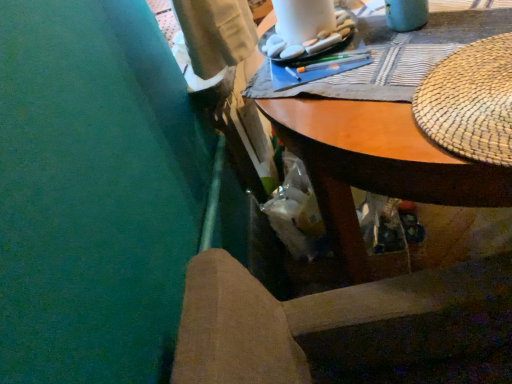
The height and width of the screenshot is (384, 512). I want to click on wooden chair at lower center, so click(x=333, y=321).

The height and width of the screenshot is (384, 512). What do you see at coordinates (470, 102) in the screenshot?
I see `woven straw placemat at upper right` at bounding box center [470, 102].

This screenshot has height=384, width=512. What are the coordinates of `wooden desk at upper center` in the screenshot? It's located at (374, 164).

What do you see at coordinates (308, 41) in the screenshot? This screenshot has width=512, height=384. I see `white matte rocks at upper center` at bounding box center [308, 41].

Measure the distance between white matte rocks at upper center and camera.

The depth of white matte rocks at upper center is 37.02 inches.

What are the coordinates of `wooden chair at lower center` in the screenshot? It's located at (333, 321).

Does white matte rocks at upper center have a greater height compared to wooden chair at lower center?

No, white matte rocks at upper center is not taller than wooden chair at lower center.

From the picture: Are white matte rocks at upper center and wooden chair at lower center located far from each other?

white matte rocks at upper center is near wooden chair at lower center, not far away.

From a real-world perspective, which object stands above the other?

In real-world perspective, white matte rocks at upper center is above.

Consider the image. Which of these two, wooden chair at lower center or wooden desk at upper center, stands shorter?

wooden chair at lower center is shorter.

From a real-world perspective, which object rests below the other?

From a 3D spatial view, wooden desk at upper center is below.

In the scene shown: Which object is further away from the camera, wooden chair at lower center or wooden desk at upper center?

wooden desk at upper center is further from the camera.

Can you tell me how much white matte rocks at upper center and woven straw placemat at upper right differ in facing direction?

white matte rocks at upper center and woven straw placemat at upper right are facing 88.7 degrees away from each other.

From the picture: Would you consider white matte rocks at upper center to be distant from woven straw placemat at upper right?

white matte rocks at upper center is actually quite close to woven straw placemat at upper right.

Is white matte rocks at upper center thinner than woven straw placemat at upper right?

Yes, white matte rocks at upper center is thinner than woven straw placemat at upper right.

Can you confirm if white matte rocks at upper center is positioned to the left of woven straw placemat at upper right?

Correct, you'll find white matte rocks at upper center to the left of woven straw placemat at upper right.

What are the coordinates of `hat that appears above the wooden desk at upper center (from a real-world perspective)` in the screenshot? It's located at (470, 102).

Considering the relative sizes of woven straw placemat at upper right and wooden desk at upper center in the image provided, is woven straw placemat at upper right shorter than wooden desk at upper center?

Yes.

Are woven straw placemat at upper right and wooden desk at upper center making contact?

No.

From a real-world perspective, is woven straw placemat at upper right on top of wooden desk at upper center?

Yes.

How distant is wooden desk at upper center from white matte rocks at upper center?

9.53 inches.

Is the depth of wooden desk at upper center greater than that of white matte rocks at upper center?

No, wooden desk at upper center is closer to the viewer.

From a real-world perspective, between wooden desk at upper center and white matte rocks at upper center, who is vertically higher?

From a 3D spatial view, white matte rocks at upper center is above.

Considering the relative sizes of wooden desk at upper center and white matte rocks at upper center in the image provided, is wooden desk at upper center bigger than white matte rocks at upper center?

Correct, wooden desk at upper center is larger in size than white matte rocks at upper center.

Which of these two, wooden chair at lower center or white matte rocks at upper center, is wider?

wooden chair at lower center.

Which of these two, wooden chair at lower center or white matte rocks at upper center, stands taller?

With more height is wooden chair at lower center.

Does wooden chair at lower center appear on the left side of white matte rocks at upper center?

In fact, wooden chair at lower center is to the right of white matte rocks at upper center.

In the scene shown: Is wooden chair at lower center further to the viewer compared to white matte rocks at upper center?

No, it is not.

Does point (486, 170) appear closer or farther from the camera than point (229, 299)?

Point (486, 170) appears to be farther away from the viewer than point (229, 299).

Between wooden desk at upper center and wooden chair at lower center, which one has less height?

With less height is wooden chair at lower center.

Based on their sizes in the image, would you say wooden desk at upper center is bigger or smaller than wooden chair at lower center?

wooden desk at upper center is bigger than wooden chair at lower center.

Identify the location of chair in front of the wooden desk at upper center. This screenshot has width=512, height=384. (333, 321).

The width and height of the screenshot is (512, 384). In order to click on food above the wooden chair at lower center (from a real-world perspective) in this screenshot , I will do `click(308, 41)`.

Image resolution: width=512 pixels, height=384 pixels. What are the coordinates of `chair in front of the wooden desk at upper center` in the screenshot? It's located at tap(333, 321).

Which object lies nearer to the anchor point white matte rocks at upper center, woven straw placemat at upper right or wooden chair at lower center?

Based on the image, woven straw placemat at upper right appears to be nearer to white matte rocks at upper center.

Which object lies further to the anchor point white matte rocks at upper center, woven straw placemat at upper right or wooden desk at upper center?

woven straw placemat at upper right.

From the image, which object appears to be nearer to woven straw placemat at upper right, wooden desk at upper center or white matte rocks at upper center?

wooden desk at upper center lies closer to woven straw placemat at upper right than the other object.

From the image, which object appears to be farther from wooden chair at lower center, white matte rocks at upper center or wooden desk at upper center?

The object further to wooden chair at lower center is white matte rocks at upper center.

Which object lies further to the anchor point woven straw placemat at upper right, white matte rocks at upper center or wooden desk at upper center?

The object further to woven straw placemat at upper right is white matte rocks at upper center.

Estimate the real-world distances between objects in this image. Which object is further from wooden chair at lower center, white matte rocks at upper center or woven straw placemat at upper right?

Among the two, white matte rocks at upper center is located further to wooden chair at lower center.

Looking at the image, which one is located further to white matte rocks at upper center, wooden chair at lower center or woven straw placemat at upper right?

wooden chair at lower center lies further to white matte rocks at upper center than the other object.

Considering their positions, is woven straw placemat at upper right positioned further to wooden desk at upper center than white matte rocks at upper center?

Based on the image, white matte rocks at upper center appears to be further to wooden desk at upper center.

Identify the location of hat between white matte rocks at upper center and wooden chair at lower center vertically. The image size is (512, 384). (470, 102).

The height and width of the screenshot is (384, 512). I want to click on desk between woven straw placemat at upper right and wooden chair at lower center vertically, so click(x=374, y=164).

At what (x,y) coordinates should I click in order to perform the action: click on desk between white matte rocks at upper center and wooden chair at lower center from top to bottom. Please return your answer as a coordinate pair (x, y). This screenshot has height=384, width=512. Looking at the image, I should click on (374, 164).

This screenshot has height=384, width=512. I want to click on hat between white matte rocks at upper center and wooden desk at upper center, so click(470, 102).